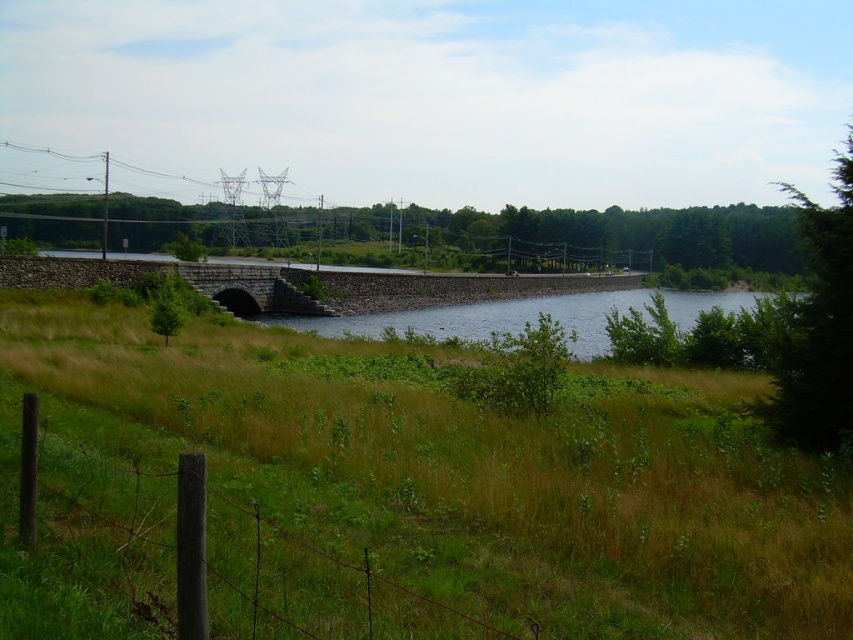
You are standing at the point marked as point [485,588] in the image. You want to walk straight towards the wire fence with wooden posts in the foreground. How far will you have to walk to reach the fence?

The point [485,588] is 6.04 meters away from the viewer. Since the wire fence with wooden posts is in the foreground, it is closer to the viewer than the point. Therefore, you would need to walk less than 6.04 meters to reach the fence.

You are a gardener planning to mow the lawn. You see the green grassy at center and the blue concrete river at center. Which area is narrower and requires less time to mow?

The green grassy at center is thinner than the blue concrete river at center, so the green grassy at center requires less time to mow since it is narrower.

You are standing at the point marked by the coordinates point (401, 490) in the image. What type of terrain are you currently on?

The point (401, 490) indicates green grassy at center, so you are standing on green grassy terrain.